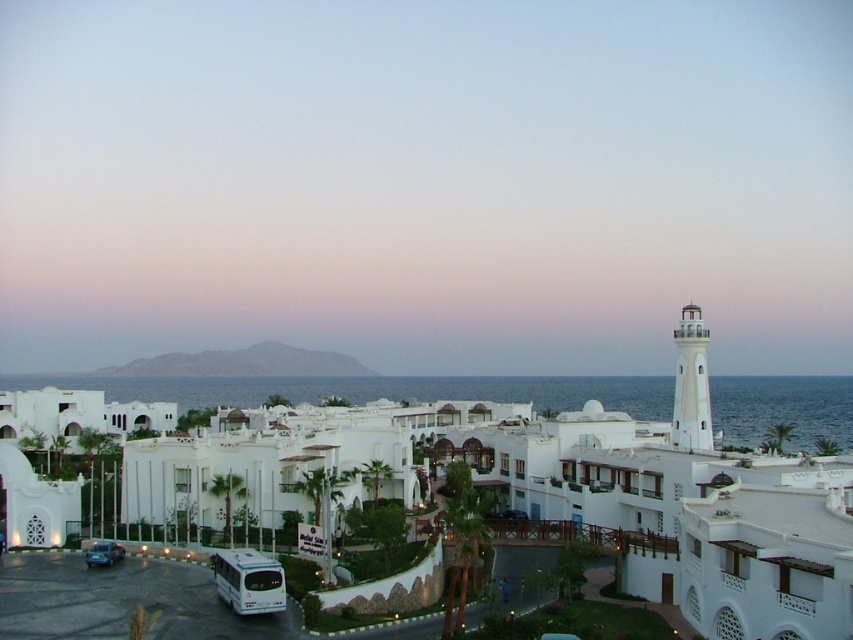
You are a photographer planning to capture the white lighthouse at right and the metallic blue car at lower left in a single shot. Considering their heights, which object will appear larger in the photo?

The white lighthouse at right is much taller than the metallic blue car at lower left, so it will appear larger in the photo.

You are a delivery driver who needs to reach the white lighthouse at right from the metallic blue car at lower left. Given that your car can travel 1000 feet on a full tank, will you need to refuel before reaching the lighthouse?

The white lighthouse at right is 974.48 feet from the metallic blue car at lower left. Since the car can travel 1000 feet on a full tank, you do not need to refuel before reaching the lighthouse.